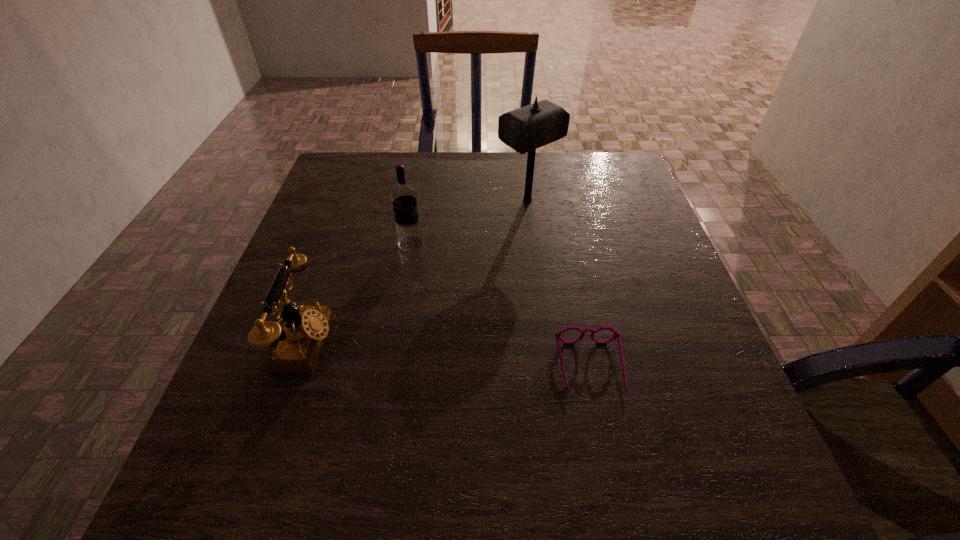
Identify the location of vacant area that lies between the second shortest object and the third shortest object. (359, 293).

Where is `free spot between the second object from left to right and the shortest object`? free spot between the second object from left to right and the shortest object is located at coordinates (500, 306).

Where is `blank region between the farthest object and the third object from right to left`? blank region between the farthest object and the third object from right to left is located at coordinates (468, 221).

Find the location of a particular element. Image resolution: width=960 pixels, height=540 pixels. free area in between the tallest object and the leftmost object is located at coordinates (417, 271).

Identify the location of free spot between the second shortest object and the farthest object. (417, 271).

Find the location of `free point between the vodka and the spectacles`. free point between the vodka and the spectacles is located at coordinates (500, 306).

Locate an element on the screen. unoccupied position between the vodka and the telephone is located at coordinates (359, 293).

Find the location of a particular element. empty space between the telephone and the third nearest object is located at coordinates (359, 293).

Identify which object is the third closest to the telephone. Please provide its 2D coordinates. Your answer should be formatted as a tuple, i.e. [(x, y)], where the tuple contains the x and y coordinates of a point satisfying the conditions above.

[(525, 129)]

Where is `object that is the closest to the shortest object`? object that is the closest to the shortest object is located at coordinates (403, 196).